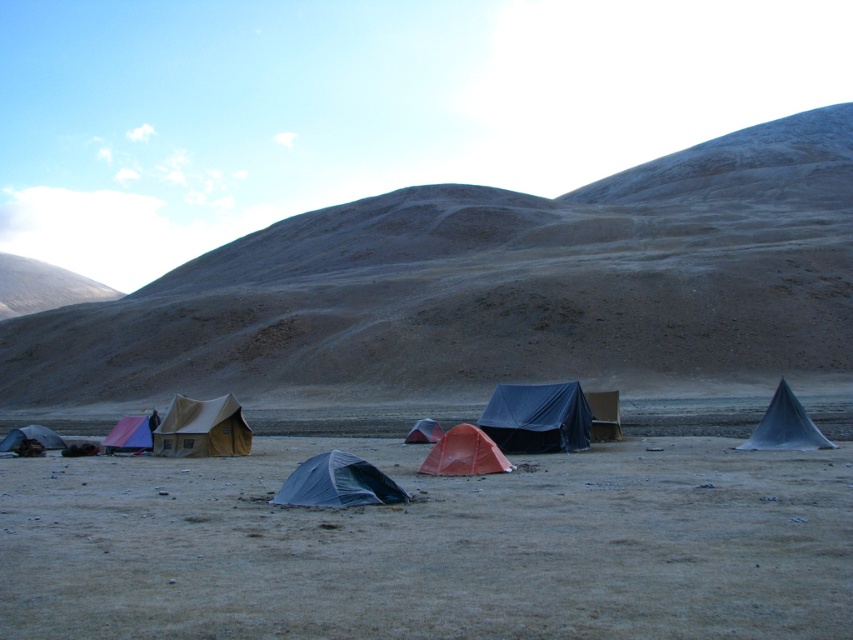
Question: Can you confirm if brown sandy dirt field at center is positioned to the left of matte beige tent at lower left?

Choices:
 (A) no
 (B) yes

Answer: (A)

Question: Which of the following is the closest to the observer?

Choices:
 (A) matte yellow tent at lower left
 (B) matte beige tent at lower left
 (C) orange fabric tent at center

Answer: (A)

Question: Which object is farther from the camera taking this photo?

Choices:
 (A) orange fabric tent at center
 (B) matte gray tent at center
 (C) matte beige tent at center
 (D) blue tarp tent at center

Answer: (B)

Question: Which object appears closest to the camera in this image?

Choices:
 (A) dull gray rock at center
 (B) matte beige tent at lower left
 (C) matte yellow tent at lower left

Answer: (C)

Question: Observing the image, what is the correct spatial positioning of matte beige tent at center in reference to orange fabric tent at center?

Choices:
 (A) right
 (B) left

Answer: (B)

Question: Is brown sandy dirt field at center below black tarp tent at center?

Choices:
 (A) yes
 (B) no

Answer: (A)